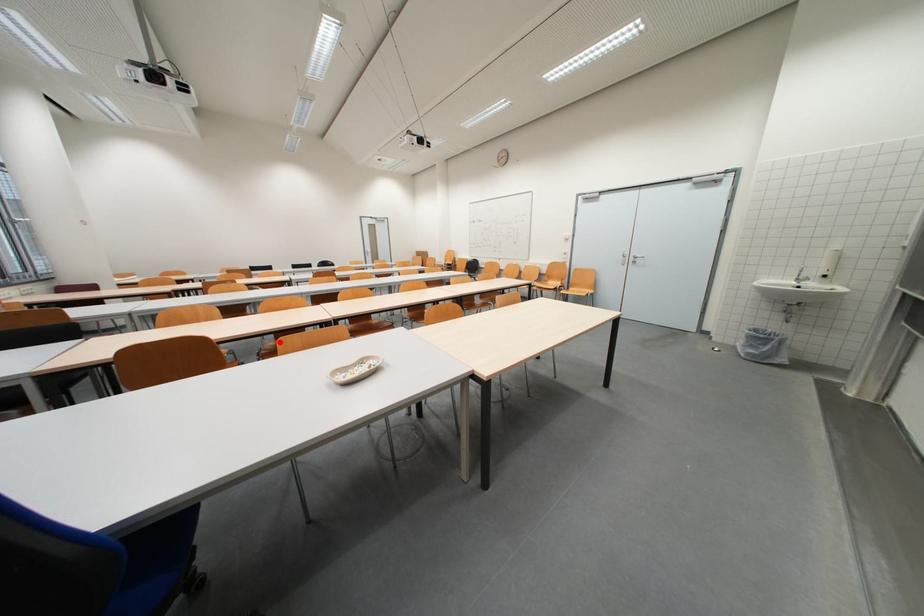
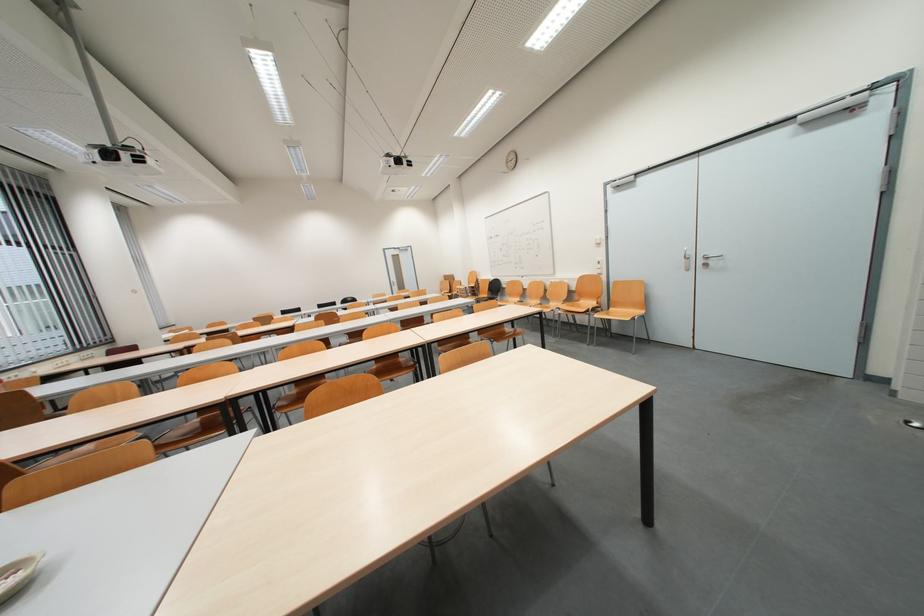
The point at the highlighted location is marked in the first image. Where is the corresponding point in the second image?

(201, 419)